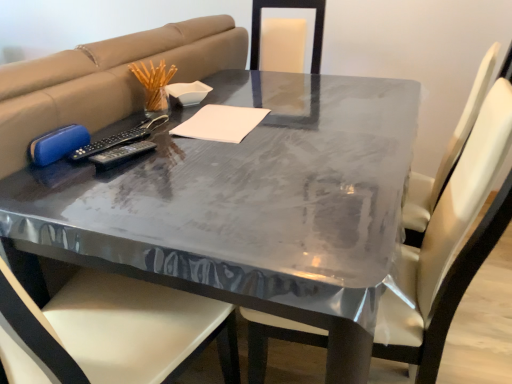
The height and width of the screenshot is (384, 512). In order to click on free location to the right of black plastic remote at center in this screenshot , I will do `click(191, 162)`.